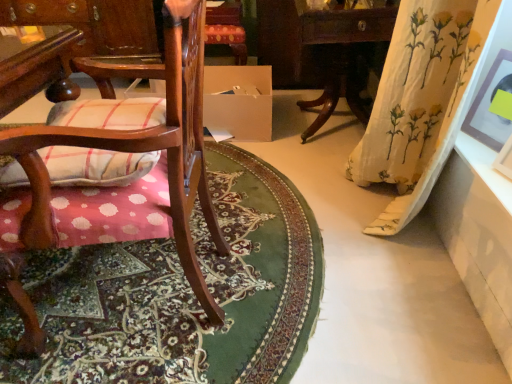
The height and width of the screenshot is (384, 512). Find the location of `vacant area that lies in front of white floral fabric curtain at right`. vacant area that lies in front of white floral fabric curtain at right is located at coordinates (390, 306).